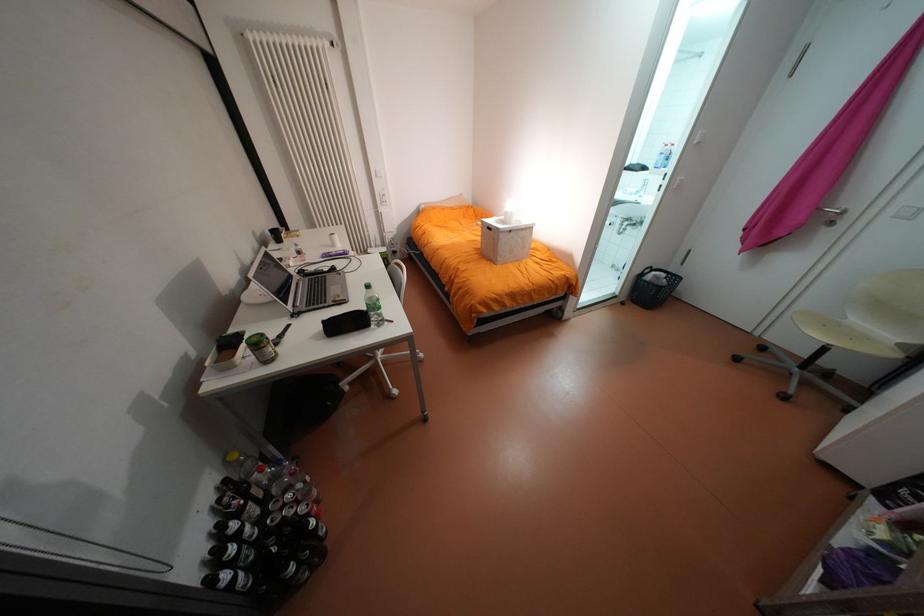
Where would you push the sink faucet? Please return your answer as a coordinate pair (x, y).

(626, 225)